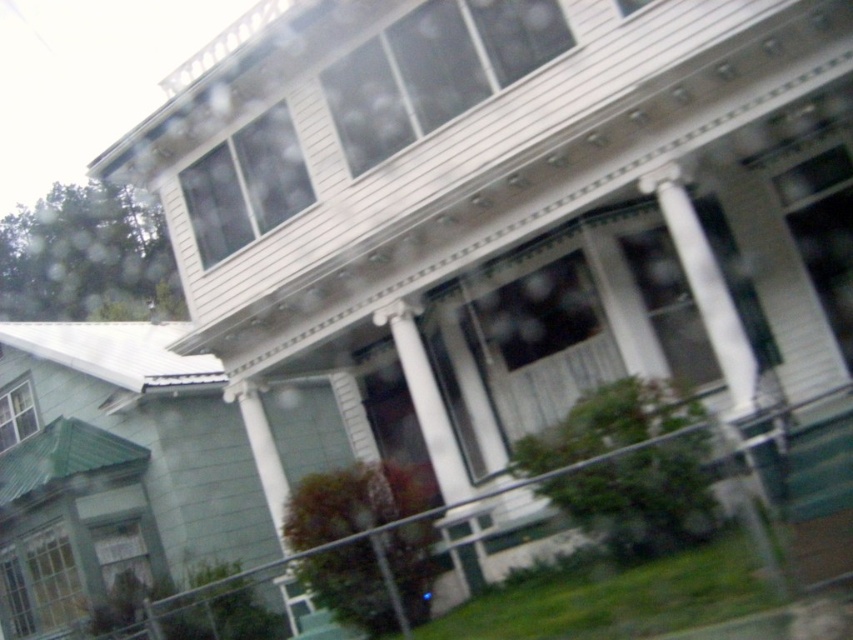
Question: Can you confirm if clear glass window at upper left is bigger than clear glass window at lower left?

Choices:
 (A) no
 (B) yes

Answer: (B)

Question: Is transparent glass window at upper center to the right of transparent glass car window at center from the viewer's perspective?

Choices:
 (A) no
 (B) yes

Answer: (A)

Question: Is transparent glass car window at center positioned in front of white wood porch at center?

Choices:
 (A) yes
 (B) no

Answer: (B)

Question: Which point is farther to the camera?

Choices:
 (A) transparent glass window at upper center
 (B) clear glass window at lower left
 (C) transparent glass car window at center
 (D) white glossy column at center

Answer: (B)

Question: Which point is closer to the camera?

Choices:
 (A) transparent glass car window at center
 (B) white glossy column at center
 (C) clear glass window at upper left
 (D) clear glass window at lower left

Answer: (B)

Question: Considering the real-world distances, which object is farthest from the white wood porch at center?

Choices:
 (A) white glossy column at center
 (B) transparent glass window at upper center

Answer: (B)